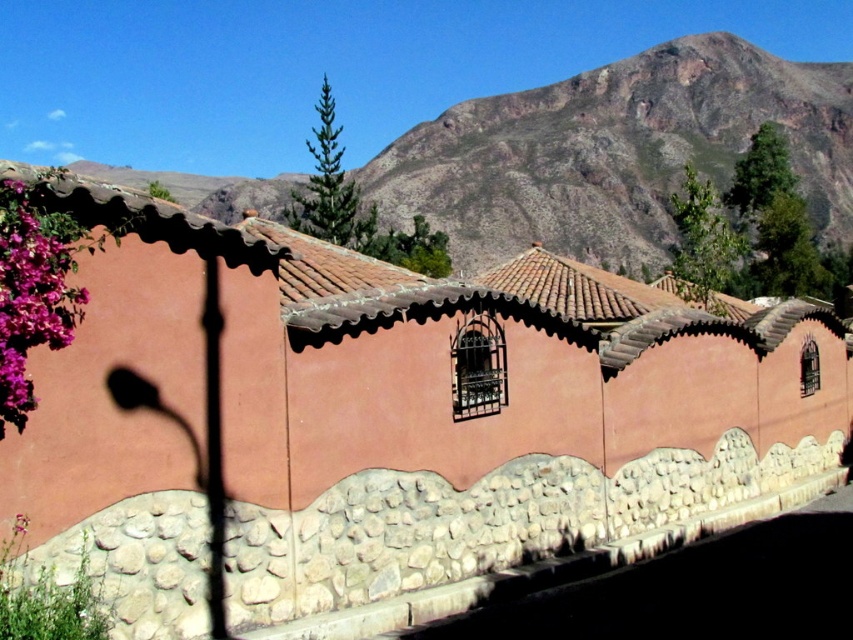
Question: Which point appears farthest from the camera in this image?

Choices:
 (A) (828, 64)
 (B) (560, 273)
 (C) (4, 321)
 (D) (415, 504)

Answer: (A)

Question: Which object is farther from the camera taking this photo?

Choices:
 (A) brown clay tile roof at center
 (B) natural stone wall at lower center
 (C) pink matte flowers at left

Answer: (A)

Question: Among these points, which one is nearest to the camera?

Choices:
 (A) (805, 141)
 (B) (314, 346)
 (C) (653, 508)
 (D) (33, 278)

Answer: (D)

Question: Is natural stone wall at lower center to the left of brown clay tile roof at center from the viewer's perspective?

Choices:
 (A) yes
 (B) no

Answer: (B)

Question: Considering the relative positions of natural stone wall at lower center and brown clay tile roof at center in the image provided, where is natural stone wall at lower center located with respect to brown clay tile roof at center?

Choices:
 (A) left
 (B) right

Answer: (B)

Question: Is the position of natural stone wall at lower center less distant than that of rustic stone mountain at upper center?

Choices:
 (A) no
 (B) yes

Answer: (B)